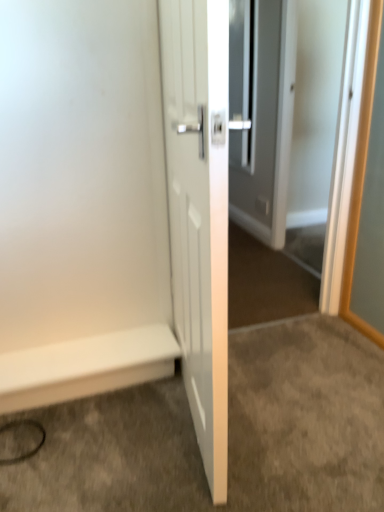
Question: Does white smooth baseboard at lower left appear on the left side of white glossy door at center?

Choices:
 (A) yes
 (B) no

Answer: (A)

Question: Is white smooth baseboard at lower left facing towards white glossy door at center?

Choices:
 (A) no
 (B) yes

Answer: (A)

Question: Can you see white smooth baseboard at lower left touching white glossy door at center?

Choices:
 (A) yes
 (B) no

Answer: (B)

Question: Is white smooth baseboard at lower left to the right of white glossy door at center from the viewer's perspective?

Choices:
 (A) no
 (B) yes

Answer: (A)

Question: Can you confirm if white smooth baseboard at lower left is bigger than white glossy door at center?

Choices:
 (A) yes
 (B) no

Answer: (B)

Question: Considering the relative positions of white glossy door at center and white smooth baseboard at lower left in the image provided, is white glossy door at center to the left or to the right of white smooth baseboard at lower left?

Choices:
 (A) left
 (B) right

Answer: (B)

Question: From the image's perspective, is white glossy door at center above or below white smooth baseboard at lower left?

Choices:
 (A) below
 (B) above

Answer: (B)

Question: Is white glossy door at center wider or thinner than white smooth baseboard at lower left?

Choices:
 (A) wide
 (B) thin

Answer: (B)

Question: Relative to white smooth baseboard at lower left, is white glossy door at center in front or behind?

Choices:
 (A) behind
 (B) front

Answer: (B)

Question: From a real-world perspective, is white glossy door at center physically located above or below white glossy door at center?

Choices:
 (A) above
 (B) below

Answer: (A)

Question: From the image's perspective, relative to white glossy door at center, is white glossy door at center above or below?

Choices:
 (A) below
 (B) above

Answer: (B)

Question: In terms of width, does white glossy door at center look wider or thinner when compared to white glossy door at center?

Choices:
 (A) wide
 (B) thin

Answer: (B)

Question: Is white glossy door at center in front of or behind white glossy door at center in the image?

Choices:
 (A) behind
 (B) front

Answer: (A)

Question: From the image's perspective, relative to white smooth baseboard at lower left, is white glossy door at center above or below?

Choices:
 (A) below
 (B) above

Answer: (B)

Question: In terms of size, does white glossy door at center appear bigger or smaller than white smooth baseboard at lower left?

Choices:
 (A) small
 (B) big

Answer: (B)